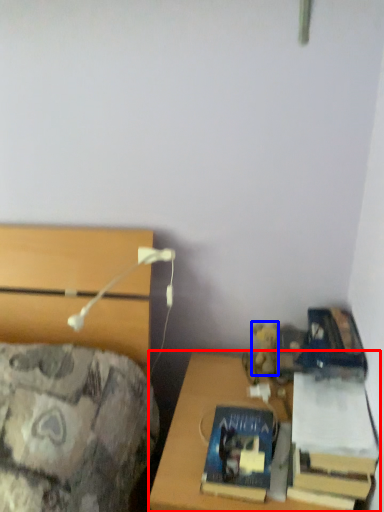
Question: Which point is further to the camera, desk (highlighted by a red box) or toy (highlighted by a blue box)?

Choices:
 (A) desk
 (B) toy

Answer: (B)